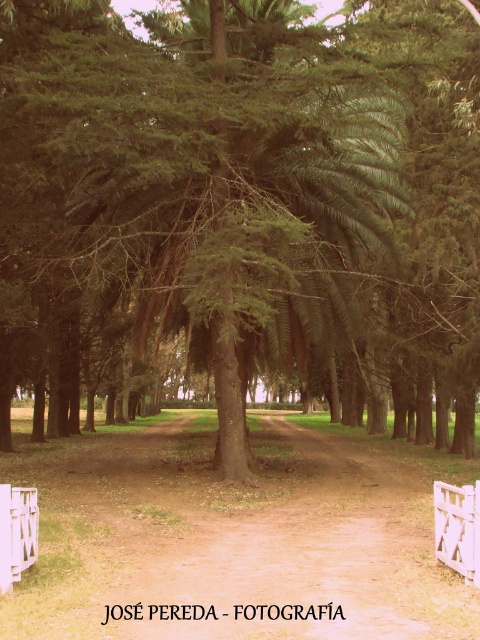
Which of these two, white wooden fence at lower right or white wooden fence at lower left, stands shorter?

Standing shorter between the two is white wooden fence at lower right.

Measure the distance between white wooden fence at lower right and camera.

The distance of white wooden fence at lower right from camera is 6.07 meters.

Which is behind, point (475, 493) or point (34, 499)?

The point (34, 499) is more distant.

You are a GUI agent. You are given a task and a screenshot of the screen. Output one action in this format:
    pyautogui.click(x=<x>, y=<y>)
    Task: Click on the white wooden fence at lower right
    
    Given the screenshot: What is the action you would take?
    pyautogui.click(x=457, y=529)